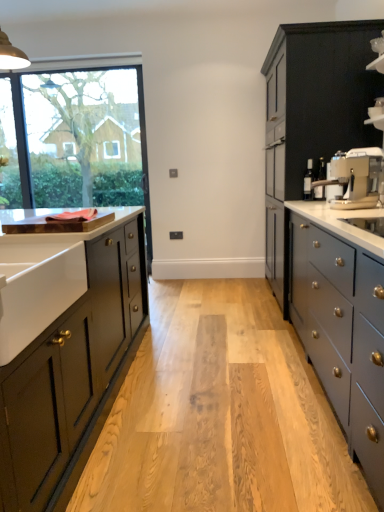
Question: Can you confirm if matte black cabinet at right, positioned as the second cabinetry in left-to-right order, is positioned to the right of matte gray countertop at right?

Choices:
 (A) yes
 (B) no

Answer: (A)

Question: Does matte black cabinet at right, positioned as the second cabinetry in left-to-right order, have a greater width compared to matte gray countertop at right?

Choices:
 (A) yes
 (B) no

Answer: (A)

Question: Does matte black cabinet at right, the second cabinetry when ordered from front to back, lie behind matte gray countertop at right?

Choices:
 (A) no
 (B) yes

Answer: (B)

Question: Is matte gray countertop at right surrounded by matte black cabinet at right, the 1th cabinetry from the right?

Choices:
 (A) no
 (B) yes

Answer: (A)

Question: From a real-world perspective, is matte black cabinet at right, the 1th cabinetry from the right, beneath matte gray countertop at right?

Choices:
 (A) no
 (B) yes

Answer: (A)

Question: Does matte black cabinet at right, positioned as the second cabinetry in left-to-right order, come in front of matte gray countertop at right?

Choices:
 (A) yes
 (B) no

Answer: (B)

Question: Is matte gray countertop at right turned away from satin silver coffee machine at right?

Choices:
 (A) yes
 (B) no

Answer: (B)

Question: From the image's perspective, would you say matte gray countertop at right is positioned over satin silver coffee machine at right?

Choices:
 (A) yes
 (B) no

Answer: (B)

Question: Does matte gray countertop at right have a larger size compared to satin silver coffee machine at right?

Choices:
 (A) no
 (B) yes

Answer: (B)

Question: Is satin silver coffee machine at right inside matte gray countertop at right?

Choices:
 (A) no
 (B) yes

Answer: (A)

Question: Does matte gray countertop at right have a smaller size compared to satin silver coffee machine at right?

Choices:
 (A) no
 (B) yes

Answer: (A)

Question: Does matte gray countertop at right lie in front of satin silver coffee machine at right?

Choices:
 (A) no
 (B) yes

Answer: (B)

Question: From the image's perspective, does satin silver coffee machine at right appear higher than white ceramic sink at left?

Choices:
 (A) yes
 (B) no

Answer: (A)